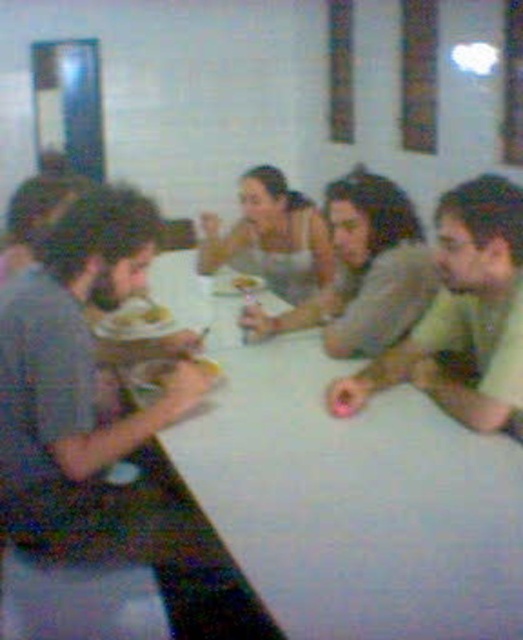
Question: Which of the following is the farthest from the observer?

Choices:
 (A) (132, 221)
 (B) (345, 237)
 (C) (130, 317)

Answer: (C)

Question: Among these points, which one is nearest to the camera?

Choices:
 (A) (244, 284)
 (B) (157, 321)

Answer: (B)

Question: Can you confirm if matte gray shirt at left is positioned above matte yellow plate at lower left?

Choices:
 (A) yes
 (B) no

Answer: (B)

Question: Is green matte shirt at center to the right of matte yellow plate at lower left from the viewer's perspective?

Choices:
 (A) yes
 (B) no

Answer: (A)

Question: Is matte gray shirt at left wider than matte plastic fork at upper center?

Choices:
 (A) no
 (B) yes

Answer: (B)

Question: Estimate the real-world distances between objects in this image. Which object is closer to the matte plastic fork at upper center?

Choices:
 (A) matte yellow plate at lower left
 (B) matte gray shirt at left

Answer: (A)